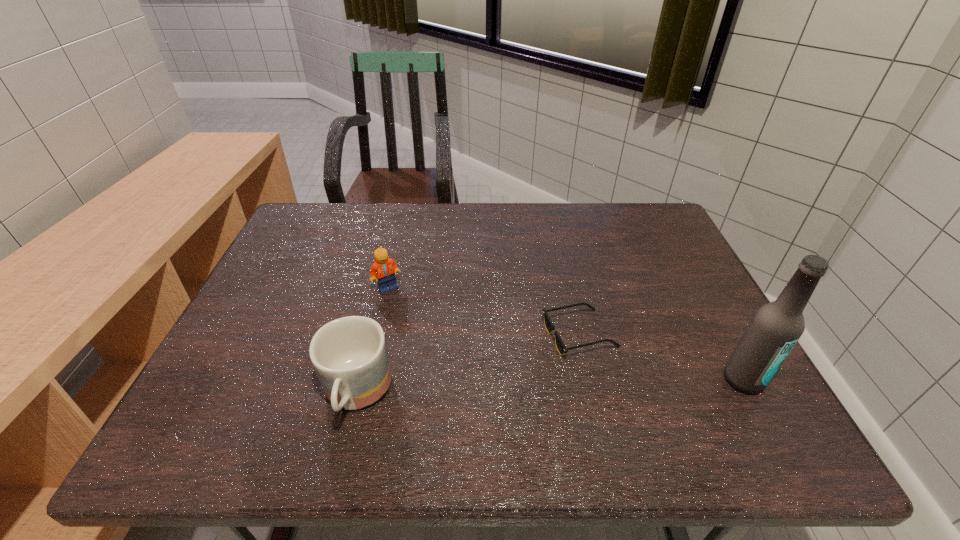
In order to click on free space on the desktop that is between the mug and the rightmost object and is positioned on the front-facing side of the farthest object in this screenshot , I will do `click(538, 388)`.

Locate an element on the screen. The image size is (960, 540). free space on the desktop that is between the mug and the tallest object and is positioned on the lenses of the sunglasses is located at coordinates (516, 389).